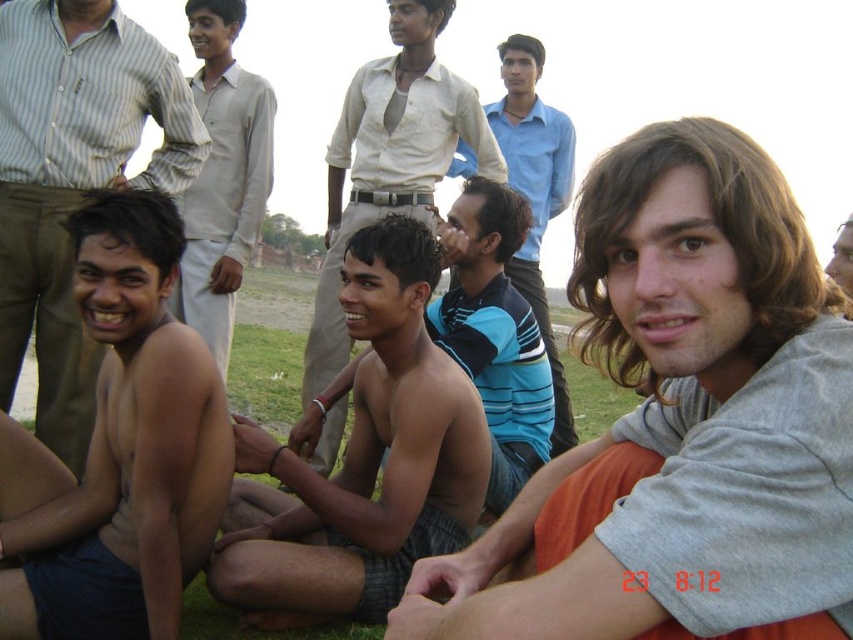
Question: Among these objects, which one is nearest to the camera?

Choices:
 (A) blue striped shirt at center
 (B) gray cotton shirt at center

Answer: (B)

Question: Which of the following is the farthest from the observer?

Choices:
 (A) blue striped shirt at center
 (B) shiny skin at lower left

Answer: (A)

Question: Which point appears closest to the camera in this image?

Choices:
 (A) (592, 348)
 (B) (361, 81)

Answer: (A)

Question: Is shiny skin boy at center above smooth skin man at center?

Choices:
 (A) no
 (B) yes

Answer: (A)

Question: Does smooth skin man at center come in front of blue striped shirt at center?

Choices:
 (A) no
 (B) yes

Answer: (B)

Question: Considering the relative positions of shiny skin boy at center and smooth skin man at center in the image provided, where is shiny skin boy at center located with respect to smooth skin man at center?

Choices:
 (A) above
 (B) below

Answer: (B)